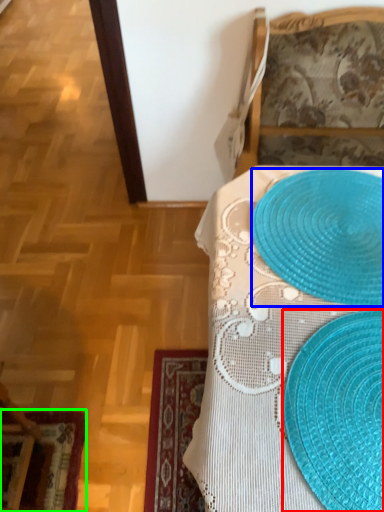
Question: Which object is the farthest from straw hat (highlighted by a red box)? Choose among these: platter (highlighted by a blue box) or place mat (highlighted by a green box).

Choices:
 (A) platter
 (B) place mat

Answer: (B)